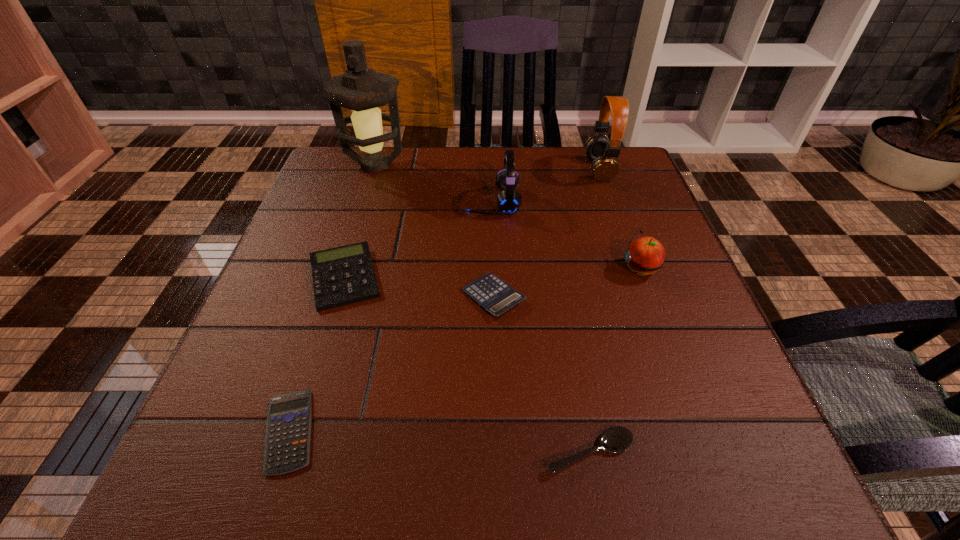
Locate an element on the screen. free space between the soupspoon and the taller headset is located at coordinates (594, 310).

Image resolution: width=960 pixels, height=540 pixels. Identify the location of free point between the farther headset and the oil lamp. (488, 167).

Find the location of a particular element. The image size is (960, 540). unoccupied position between the taller headset and the nearest calculator is located at coordinates (444, 300).

Where is `free point between the tallest object and the soupspoon`? Image resolution: width=960 pixels, height=540 pixels. free point between the tallest object and the soupspoon is located at coordinates (483, 308).

Find the location of `the third closest object to the third tallest object`. the third closest object to the third tallest object is located at coordinates (344, 275).

Select which object is the fifth closest to the farther headset. Please provide its 2D coordinates. Your answer should be formatted as a tuple, i.e. [(x, y)], where the tuple contains the x and y coordinates of a point satisfying the conditions above.

[(344, 275)]

Identify the location of the closest calculator to the apple. (495, 296).

Select which calculator is the closest to the second tallest calculator. Please provide its 2D coordinates. Your answer should be formatted as a tuple, i.e. [(x, y)], where the tuple contains the x and y coordinates of a point satisfying the conditions above.

[(344, 275)]

The image size is (960, 540). I want to click on free location that satisfies the following two spatial constraints: 1. on the ear cushions of the third tallest object; 2. on the front side of the second tallest calculator, so click(x=495, y=297).

Identify the location of vacant space that satisfies the following two spatial constraints: 1. on the back side of the nearest calculator; 2. on the right side of the rightmost calculator. (332, 297).